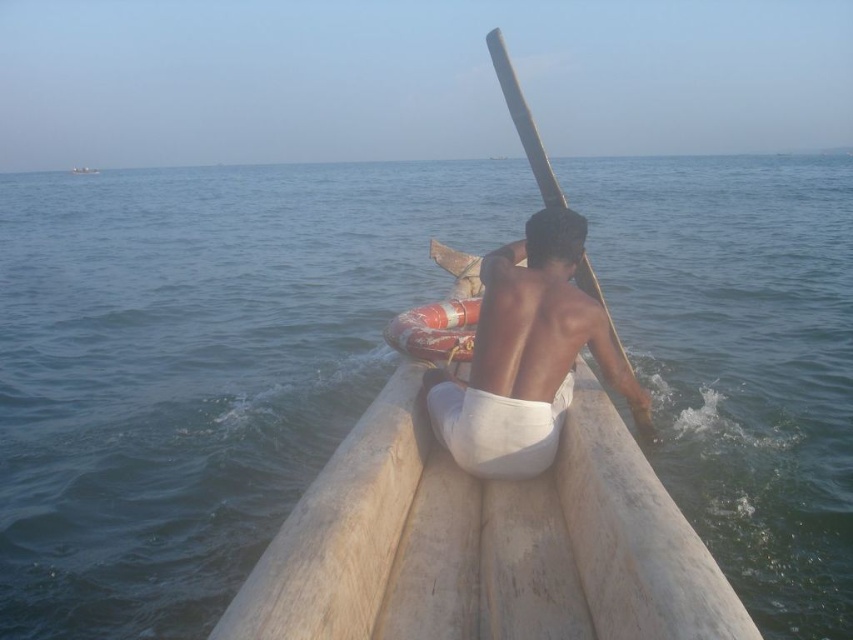
Question: Is light brown wooden boat at center to the left of wooden boat at upper center from the viewer's perspective?

Choices:
 (A) yes
 (B) no

Answer: (B)

Question: Which point appears closest to the camera in this image?

Choices:
 (A) (550, 264)
 (B) (500, 61)

Answer: (A)

Question: Considering the real-world distances, which object is farthest from the wooden boat at upper center?

Choices:
 (A) light brown wooden boat at center
 (B) smooth wooden paddle at center

Answer: (B)

Question: Is light brown wooden boat at center wider than smooth wooden paddle at center?

Choices:
 (A) yes
 (B) no

Answer: (A)

Question: Based on their relative distances, which object is farther from the light brown wooden boat at center?

Choices:
 (A) smooth wooden paddle at center
 (B) wooden boat at upper center

Answer: (B)

Question: Is smooth wooden paddle at center to the right of wooden boat at upper center from the viewer's perspective?

Choices:
 (A) yes
 (B) no

Answer: (A)